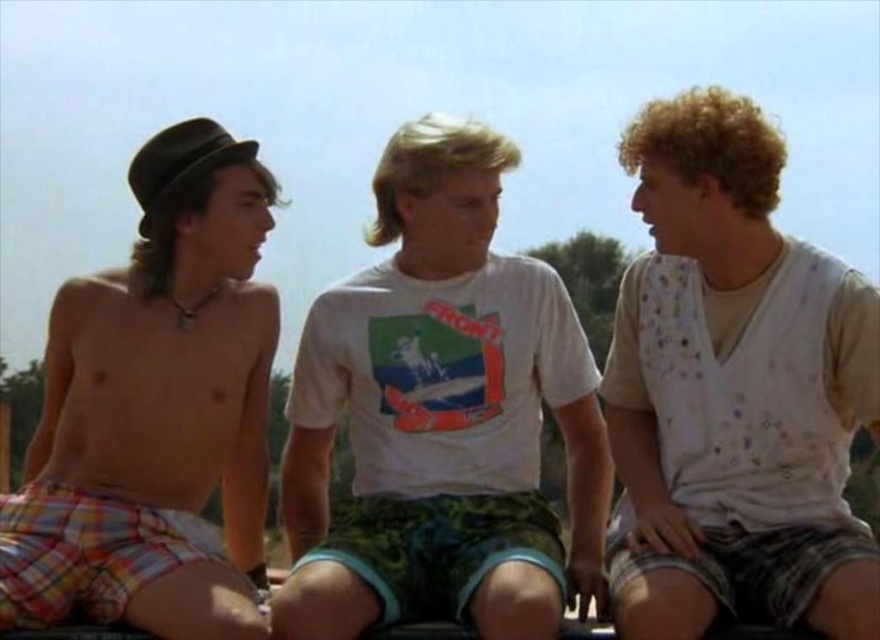
Question: Which of the following is the farthest from the observer?

Choices:
 (A) plaid shorts at left
 (B) white dotted shirt at right

Answer: (A)

Question: Is white cotton t-shirt at center below plaid shorts at left?

Choices:
 (A) yes
 (B) no

Answer: (A)

Question: Can you confirm if white cotton t-shirt at center is positioned to the left of plaid shorts at left?

Choices:
 (A) no
 (B) yes

Answer: (A)

Question: Which of the following is the closest to the observer?

Choices:
 (A) [x=143, y=442]
 (B) [x=391, y=609]
 (C) [x=638, y=451]

Answer: (B)

Question: Is white cotton t-shirt at center wider than plaid shorts at left?

Choices:
 (A) no
 (B) yes

Answer: (B)

Question: Which of these objects is positioned closest to the white cotton t-shirt at center?

Choices:
 (A) white dotted shirt at right
 (B) plaid shorts at left

Answer: (B)